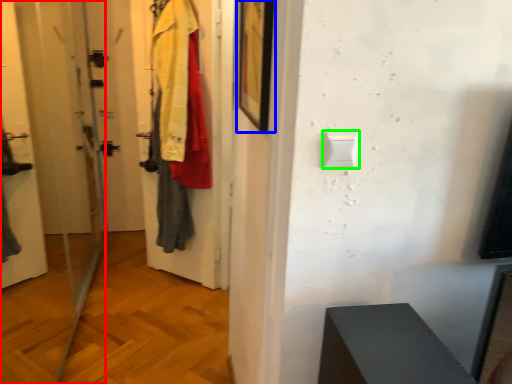
Question: Which object is the farthest from screen door (highlighted by a red box)? Choose among these: picture frame (highlighted by a blue box) or light switch (highlighted by a green box).

Choices:
 (A) picture frame
 (B) light switch

Answer: (B)